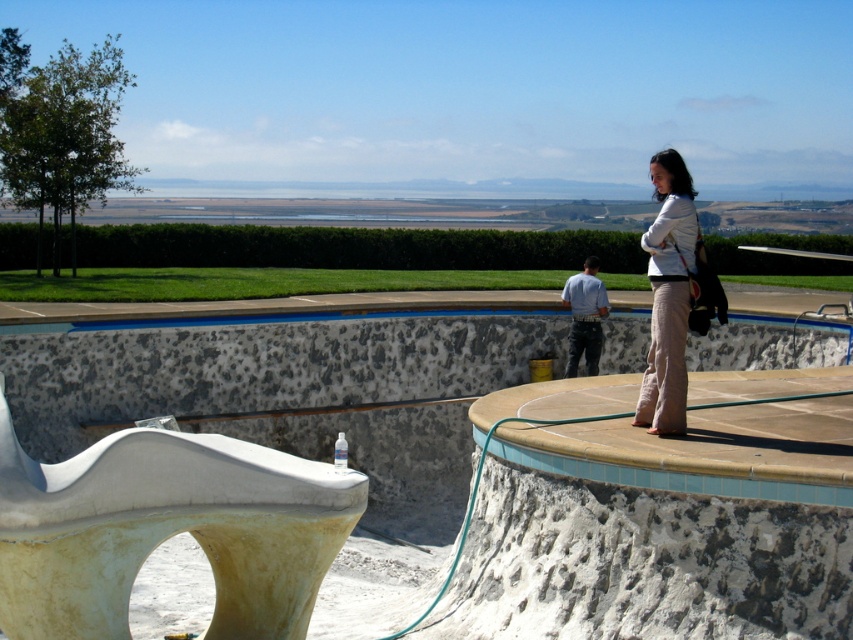
Is white concrete sculpture at lower left positioned in front of blue cotton shirt at center?

Yes, it is.

Between white concrete sculpture at lower left and blue cotton shirt at center, which one appears on the left side from the viewer's perspective?

From the viewer's perspective, white concrete sculpture at lower left appears more on the left side.

Is point (297, 637) positioned behind point (576, 276)?

No, it is in front of (576, 276).

You are a GUI agent. You are given a task and a screenshot of the screen. Output one action in this format:
    pyautogui.click(x=<x>, y=<y>)
    Task: Click on the white concrete sculpture at lower left
    The width and height of the screenshot is (853, 640).
    Given the screenshot: What is the action you would take?
    pyautogui.click(x=166, y=531)

This screenshot has width=853, height=640. In order to click on light beige pants at center in this screenshot , I will do `click(666, 296)`.

Looking at this image, does light beige pants at center have a larger size compared to blue cotton shirt at center?

Correct, light beige pants at center is larger in size than blue cotton shirt at center.

This screenshot has height=640, width=853. What are the coordinates of `light beige pants at center` in the screenshot? It's located at (666, 296).

This screenshot has height=640, width=853. I want to click on light beige pants at center, so click(x=666, y=296).

Can you confirm if white concrete sculpture at lower left is shorter than light beige pants at center?

Yes.

Does white concrete sculpture at lower left have a lesser width compared to light beige pants at center?

Incorrect, white concrete sculpture at lower left's width is not less than light beige pants at center's.

Who is more forward, (108,509) or (677,380)?

Point (108,509) is in front.

What are the coordinates of `white concrete sculpture at lower left` in the screenshot? It's located at (166, 531).